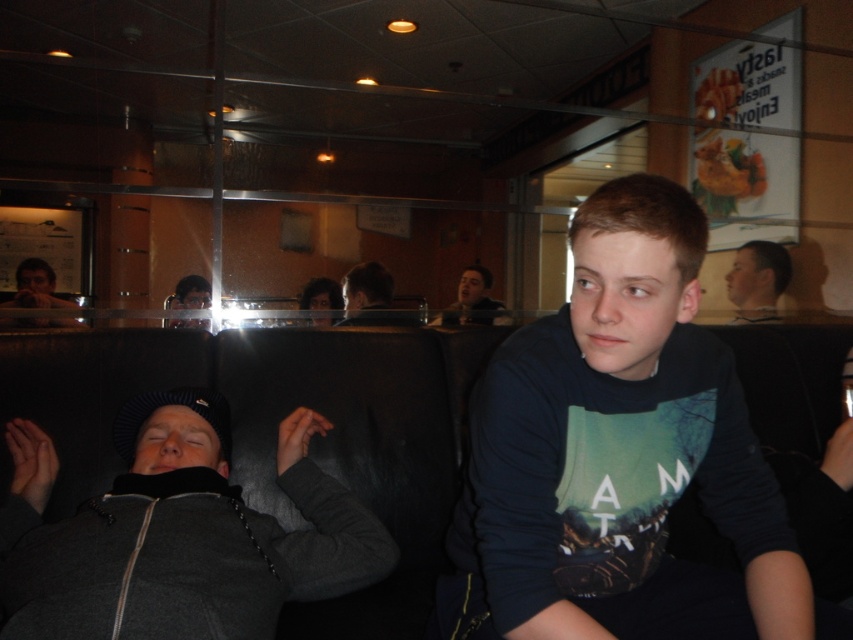
Is gray fleece jacket at lower left smaller than matte black laptop at left?

No, gray fleece jacket at lower left is not smaller than matte black laptop at left.

Is point (140, 563) farther from camera compared to point (32, 300)?

No, (140, 563) is closer to viewer.

Is point (109, 595) in front of point (10, 321)?

Yes, point (109, 595) is in front of point (10, 321).

Where is `gray fleece jacket at lower left`? gray fleece jacket at lower left is located at coordinates (177, 532).

Can you confirm if gray fleece jacket at lower left is smaller than smooth skin face at center?

No, gray fleece jacket at lower left is not smaller than smooth skin face at center.

Is point (28, 577) positioned in front of point (471, 316)?

Yes, it is.

Identify the location of gray fleece jacket at lower left. (177, 532).

Is dark blue cotton shirt at center smaller than matte black laptop at left?

Yes.

Does dark blue cotton shirt at center appear on the right side of matte black laptop at left?

Yes, dark blue cotton shirt at center is to the right of matte black laptop at left.

Which is in front, point (514, 609) or point (50, 324)?

Point (514, 609) is more forward.

Where is `dark blue cotton shirt at center`? This screenshot has height=640, width=853. dark blue cotton shirt at center is located at coordinates (618, 436).